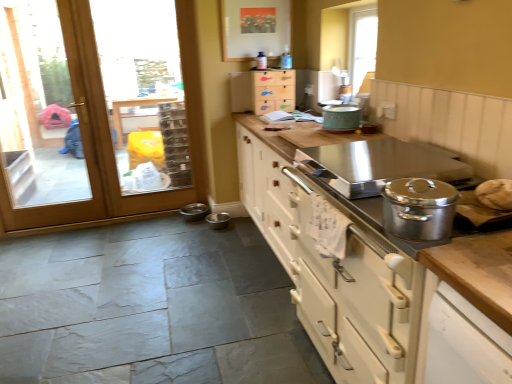
I want to click on vacant location below metallic stainless steel bowl at lower center, the first appliance viewed from the right (from a real-world perspective), so click(x=222, y=219).